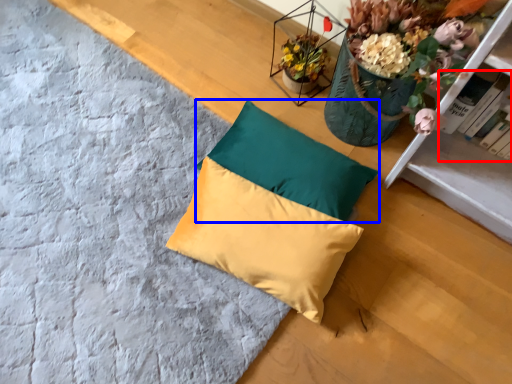
Question: Which point is closer to the camera, book (highlighted by a red box) or pillow (highlighted by a blue box)?

Choices:
 (A) book
 (B) pillow

Answer: (A)